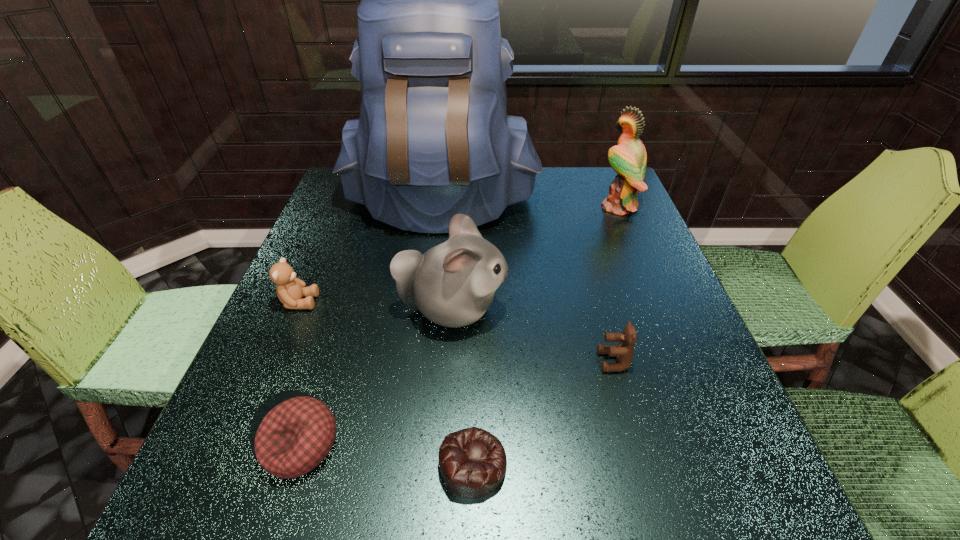
This screenshot has width=960, height=540. I want to click on object present at the near left corner, so click(x=294, y=437).

At what (x,y) coordinates should I click in order to perform the action: click on object at the far right corner. Please return your answer as a coordinate pair (x, y). This screenshot has width=960, height=540. Looking at the image, I should click on (628, 158).

The width and height of the screenshot is (960, 540). In the image, there is a desktop. Find the location of `vacant space at the far edge`. vacant space at the far edge is located at coordinates (547, 204).

Find the location of a particular element. vacant space at the near edge of the desktop is located at coordinates (630, 520).

In the image, there is a desktop. What are the coordinates of `free space at the left edge` in the screenshot? It's located at (198, 467).

This screenshot has width=960, height=540. In the image, there is a desktop. Identify the location of vacant space at the right edge. (669, 319).

Locate an element on the screen. free space at the far right corner of the desktop is located at coordinates (593, 185).

Where is `free spot between the tallest object and the left beanbag`? The image size is (960, 540). free spot between the tallest object and the left beanbag is located at coordinates (371, 323).

Where is `vacant space that is in between the parrot and the second object from right to left`? The height and width of the screenshot is (540, 960). vacant space that is in between the parrot and the second object from right to left is located at coordinates (616, 284).

Where is `free space that is in between the second object from right to left and the right beanbag`? This screenshot has height=540, width=960. free space that is in between the second object from right to left and the right beanbag is located at coordinates (543, 413).